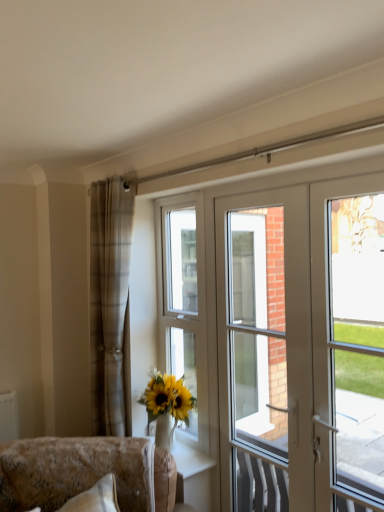
Question: Is white glossy door at center taller than white glossy door at right?

Choices:
 (A) no
 (B) yes

Answer: (A)

Question: Does white glossy door at center have a lesser height compared to white glossy door at right?

Choices:
 (A) no
 (B) yes

Answer: (B)

Question: Considering the relative positions of white glossy door at center and white glossy door at right in the image provided, is white glossy door at center to the left of white glossy door at right from the viewer's perspective?

Choices:
 (A) no
 (B) yes

Answer: (B)

Question: Is white glossy door at center positioned beyond the bounds of white glossy door at right?

Choices:
 (A) yes
 (B) no

Answer: (B)

Question: Is white glossy door at center in front of white glossy door at right?

Choices:
 (A) yes
 (B) no

Answer: (B)

Question: Is point (382, 352) positioned closer to the camera than point (206, 464)?

Choices:
 (A) closer
 (B) farther

Answer: (A)

Question: Looking at their shapes, would you say white glossy door at right is wider or thinner than white glossy vase at lower center?

Choices:
 (A) thin
 (B) wide

Answer: (A)

Question: From the image's perspective, is white glossy door at right positioned above or below white glossy vase at lower center?

Choices:
 (A) below
 (B) above

Answer: (B)

Question: Relative to white glossy vase at lower center, is white glossy door at right in front or behind?

Choices:
 (A) front
 (B) behind

Answer: (A)

Question: Is point (180, 303) positioned closer to the camera than point (127, 504)?

Choices:
 (A) closer
 (B) farther

Answer: (B)

Question: From the image's perspective, is white plastic window at center located above or below velvet beige sofa at lower left?

Choices:
 (A) above
 (B) below

Answer: (A)

Question: Considering the positions of white plastic window at center and velvet beige sofa at lower left in the image, is white plastic window at center wider or thinner than velvet beige sofa at lower left?

Choices:
 (A) wide
 (B) thin

Answer: (B)

Question: From a real-world perspective, is white plastic window at center positioned above or below velvet beige sofa at lower left?

Choices:
 (A) below
 (B) above

Answer: (B)

Question: From their relative heights in the image, would you say white glossy vase at lower center is taller or shorter than plaid fabric curtain at left?

Choices:
 (A) short
 (B) tall

Answer: (A)

Question: Considering the positions of white glossy vase at lower center and plaid fabric curtain at left in the image, is white glossy vase at lower center wider or thinner than plaid fabric curtain at left?

Choices:
 (A) thin
 (B) wide

Answer: (B)